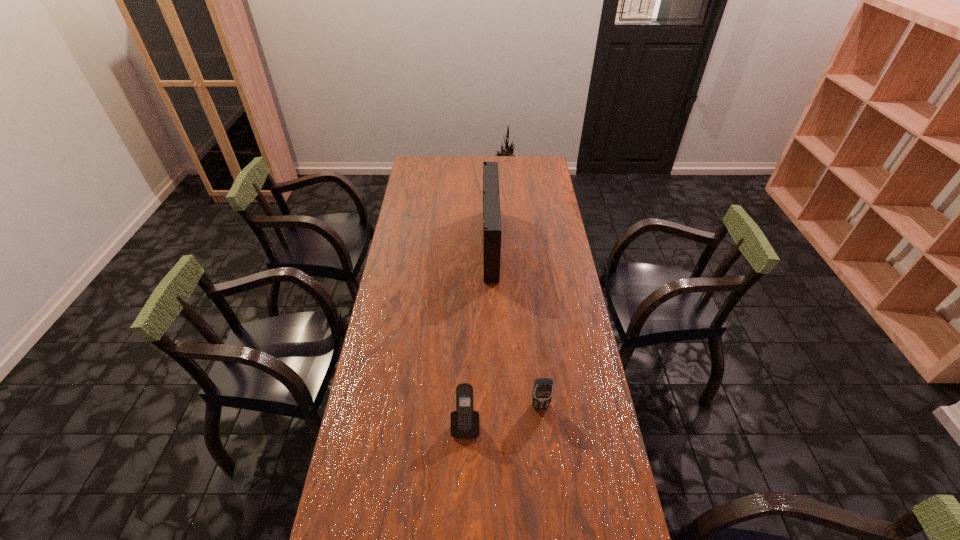
You are a GUI agent. You are given a task and a screenshot of the screen. Output one action in this format:
    pyautogui.click(x=<x>, y=<y>)
    Task: Click on the second object from right to left
    
    Given the screenshot: What is the action you would take?
    click(x=492, y=231)

You are a GUI agent. You are given a task and a screenshot of the screen. Output one action in this format:
    pyautogui.click(x=<x>, y=<y>)
    Task: Click on the farthest object
    The height and width of the screenshot is (540, 960).
    Given the screenshot: What is the action you would take?
    pyautogui.click(x=492, y=231)

This screenshot has width=960, height=540. I want to click on the left cellular telephone, so click(x=464, y=421).

Identify the location of the nearest object. point(464,421).

At what (x,y) coordinates should I click in order to perform the action: click on the farther cellular telephone. Please return your answer as a coordinate pair (x, y). Looking at the image, I should click on (542, 393).

I want to click on the right cellular telephone, so click(x=542, y=393).

Identify the location of vacant space located 0.380m on the side of the tallest object with visible spindles. This screenshot has width=960, height=540. (396, 244).

Find the location of a particular element. This screenshot has height=540, width=960. free location located on the side of the tallest object with visible spindles is located at coordinates (443, 244).

What are the coordinates of `vacant space located 0.120m on the side of the tallest object with visible spindles` in the screenshot? It's located at (456, 244).

You are a GUI agent. You are given a task and a screenshot of the screen. Output one action in this format:
    pyautogui.click(x=<x>, y=<y>)
    Task: Click on the vacant space situated on the front-facing side of the leftmost object
    The width and height of the screenshot is (960, 540).
    Given the screenshot: What is the action you would take?
    pyautogui.click(x=464, y=503)